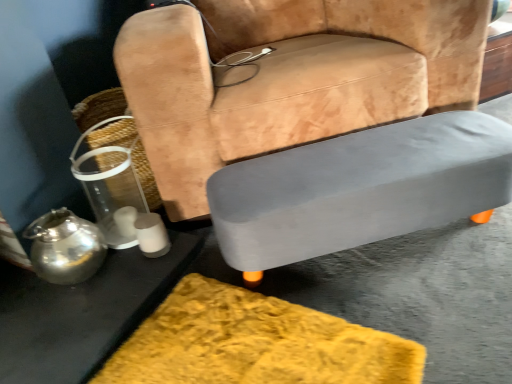
Question: Should I look upward or downward to see clear plastic basket at left?

Choices:
 (A) down
 (B) up

Answer: (B)

Question: Can you confirm if metallic silver table at lower left, the first table from the left, is bigger than gray matte table at lower right, the 1th table when ordered from right to left?

Choices:
 (A) yes
 (B) no

Answer: (B)

Question: Would you consider metallic silver table at lower left, the second table in the right-to-left sequence, to be distant from gray matte table at lower right, the 1th table when ordered from right to left?

Choices:
 (A) no
 (B) yes

Answer: (A)

Question: Is metallic silver table at lower left, the first table from the left, smaller than gray matte table at lower right, the 1th table when ordered from right to left?

Choices:
 (A) yes
 (B) no

Answer: (A)

Question: From a real-world perspective, is metallic silver table at lower left, the second table in the right-to-left sequence, located beneath gray matte table at lower right, the 1th table when ordered from right to left?

Choices:
 (A) no
 (B) yes

Answer: (B)

Question: Does metallic silver table at lower left, the second table in the right-to-left sequence, appear on the left side of gray matte table at lower right, the 2th table when ordered from left to right?

Choices:
 (A) no
 (B) yes

Answer: (B)

Question: From the image's perspective, is metallic silver table at lower left, the second table in the right-to-left sequence, below gray matte table at lower right, the 2th table when ordered from left to right?

Choices:
 (A) yes
 (B) no

Answer: (A)

Question: Is gray matte table at lower right, the 2th table when ordered from left to right, in front of clear plastic basket at left?

Choices:
 (A) no
 (B) yes

Answer: (B)

Question: Could you tell me if gray matte table at lower right, the 2th table when ordered from left to right, is facing clear plastic basket at left?

Choices:
 (A) no
 (B) yes

Answer: (A)

Question: Is gray matte table at lower right, the 2th table when ordered from left to right, further to camera compared to clear plastic basket at left?

Choices:
 (A) no
 (B) yes

Answer: (A)

Question: Considering the relative sizes of gray matte table at lower right, the 1th table when ordered from right to left, and clear plastic basket at left in the image provided, is gray matte table at lower right, the 1th table when ordered from right to left, bigger than clear plastic basket at left?

Choices:
 (A) yes
 (B) no

Answer: (A)

Question: Does gray matte table at lower right, the 2th table when ordered from left to right, have a lesser width compared to clear plastic basket at left?

Choices:
 (A) yes
 (B) no

Answer: (A)

Question: From a real-world perspective, is gray matte table at lower right, the 1th table when ordered from right to left, physically below clear plastic basket at left?

Choices:
 (A) yes
 (B) no

Answer: (A)

Question: Is clear plastic basket at left located outside suede-like tan chair at center?

Choices:
 (A) yes
 (B) no

Answer: (A)